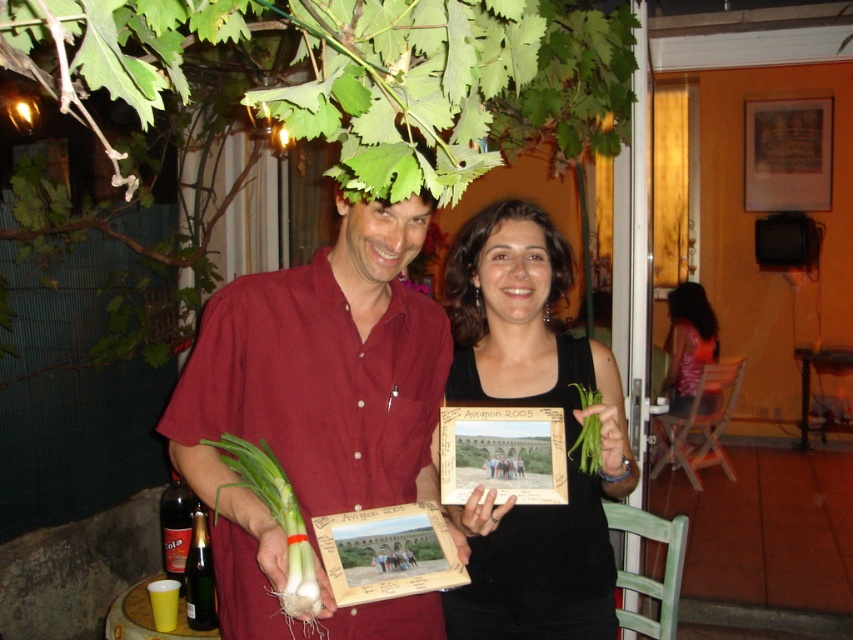
Question: Does wooden picture frame at upper right appear over wooden photo frame at center?

Choices:
 (A) no
 (B) yes

Answer: (B)

Question: Which object is closer to the camera taking this photo?

Choices:
 (A) matte red shirt at center
 (B) wooden picture frame at upper right

Answer: (A)

Question: Which point is closer to the camera?

Choices:
 (A) (132, 29)
 (B) (253, 445)

Answer: (A)

Question: Which object is farther from the camera taking this photo?

Choices:
 (A) wooden picture frame at upper right
 (B) wooden photo frame at center
 (C) green leafy plant at upper center

Answer: (A)

Question: Can you confirm if black matte tank top at center is wider than green leafy vegetable at center?

Choices:
 (A) no
 (B) yes

Answer: (B)

Question: Can you confirm if wooden picture frame at upper right is positioned to the left of green leafy vegetable at center?

Choices:
 (A) no
 (B) yes

Answer: (A)